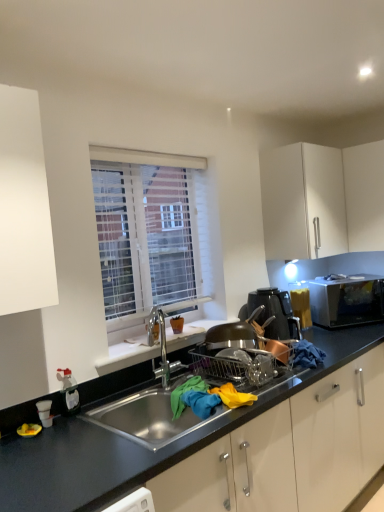
Image resolution: width=384 pixels, height=512 pixels. I want to click on white matte window sill at center, so click(x=127, y=355).

Where is `white matte cabinet at upper right`? The image size is (384, 512). white matte cabinet at upper right is located at coordinates (302, 200).

What do you see at coordinates (302, 200) in the screenshot? The width and height of the screenshot is (384, 512). I see `white matte cabinet at upper right` at bounding box center [302, 200].

Where is `metallic copper pot at right`? The height and width of the screenshot is (512, 384). metallic copper pot at right is located at coordinates (275, 313).

Locate an element on the screen. The image size is (384, 512). stainless steel sink at center is located at coordinates (148, 417).

Where is `white matte window sill at center`? The height and width of the screenshot is (512, 384). white matte window sill at center is located at coordinates (127, 355).

From the image's perspective, is white matte window sill at center positioned above or below white textured blinds at upper center?

white matte window sill at center is below white textured blinds at upper center.

Between point (138, 349) and point (149, 241), which one is positioned behind?

The point (149, 241) is more distant.

Locate an element on the screen. Image resolution: width=384 pixels, height=512 pixels. window sill on the right of white textured blinds at upper center is located at coordinates (127, 355).

Looking at their sizes, would you say white matte window sill at center is wider or thinner than white textured blinds at upper center?

white matte window sill at center is wider than white textured blinds at upper center.

Considering the points (114, 346) and (321, 244), which point is in front, point (114, 346) or point (321, 244)?

The point (114, 346) is closer.

Considering their positions, is white matte window sill at center located in front of or behind white matte cabinet at upper right?

white matte window sill at center is positioned closer to the viewer than white matte cabinet at upper right.

How many degrees apart are the facing directions of white matte window sill at center and white matte cabinet at upper right?

white matte window sill at center and white matte cabinet at upper right are facing 0.478 degrees away from each other.

Can you confirm if white matte window sill at center is positioned to the left of white matte cabinet at upper right?

Correct, you'll find white matte window sill at center to the left of white matte cabinet at upper right.

Can you confirm if satin silver microwave at right is positioned to the right of white matte window sill at center?

Indeed, satin silver microwave at right is positioned on the right side of white matte window sill at center.

The width and height of the screenshot is (384, 512). I want to click on microwave oven that is above the white matte window sill at center (from a real-world perspective), so click(346, 300).

Is satin silver microwave at right situated inside white matte window sill at center or outside?

The correct answer is: outside.

Which is in front, point (375, 295) or point (179, 339)?

The point (179, 339) is more forward.

Considering the sizes of stainless steel sink at center and white matte cabinet at upper right in the image, is stainless steel sink at center wider or thinner than white matte cabinet at upper right?

Clearly, stainless steel sink at center has more width compared to white matte cabinet at upper right.

Which object is positioned more to the right, stainless steel sink at center or white matte cabinet at upper right?

Positioned to the right is white matte cabinet at upper right.

Which is farther from the camera, (144, 426) or (331, 170)?

The point (331, 170) is behind.

What's the angular difference between stainless steel sink at center and white matte cabinet at upper right's facing directions?

The angular difference between stainless steel sink at center and white matte cabinet at upper right is 0.454 degrees.

Which of these two, metallic copper pot at right or satin silver microwave at right, stands taller?

Standing taller between the two is metallic copper pot at right.

The width and height of the screenshot is (384, 512). Find the location of `home appliance above the satin silver microwave at right (from a real-world perspective)`. home appliance above the satin silver microwave at right (from a real-world perspective) is located at coordinates (275, 313).

Would you consider metallic copper pot at right to be distant from satin silver microwave at right?

No.

Considering the relative sizes of satin silver microwave at right and stainless steel sink at center in the image provided, is satin silver microwave at right shorter than stainless steel sink at center?

Correct, satin silver microwave at right is not as tall as stainless steel sink at center.

Locate an element on the screen. This screenshot has width=384, height=512. sink in front of the satin silver microwave at right is located at coordinates (148, 417).

In the scene shown: Considering the sizes of objects satin silver microwave at right and stainless steel sink at center in the image provided, who is smaller, satin silver microwave at right or stainless steel sink at center?

With smaller size is satin silver microwave at right.

Is stainless steel sink at center surrounded by satin silver microwave at right?

No, stainless steel sink at center is located outside of satin silver microwave at right.

Could you tell me if satin silver microwave at right is turned towards metallic copper pot at right?

No, satin silver microwave at right is not aimed at metallic copper pot at right.

Is satin silver microwave at right next to metallic copper pot at right?

No, satin silver microwave at right is not making contact with metallic copper pot at right.

Can we say satin silver microwave at right lies outside metallic copper pot at right?

Yes.

Where is `window sill on the right of white textured blinds at upper center`? This screenshot has height=512, width=384. window sill on the right of white textured blinds at upper center is located at coordinates (127, 355).

Find the location of a particular element. This screenshot has height=512, width=384. window sill below the white matte cabinet at upper right (from the image's perspective) is located at coordinates (127, 355).

When comparing their distances from satin silver microwave at right, does white textured blinds at upper center or metallic copper pot at right seem closer?

The object closer to satin silver microwave at right is metallic copper pot at right.

Considering their positions, is metallic copper pot at right positioned further to satin silver microwave at right than white matte window sill at center?

Among the two, white matte window sill at center is located further to satin silver microwave at right.

Consider the image. From the image, which object appears to be farther from white matte cabinet at upper right, satin silver microwave at right or white matte window sill at center?

white matte window sill at center is further to white matte cabinet at upper right.

Looking at the image, which one is located closer to satin silver microwave at right, white textured blinds at upper center or white matte cabinet at upper right?

white matte cabinet at upper right is closer to satin silver microwave at right.

Which object lies nearer to the anchor point white matte cabinet at upper right, stainless steel sink at center or white textured blinds at upper center?

white textured blinds at upper center is closer to white matte cabinet at upper right.

Considering their positions, is white matte cabinet at upper right positioned further to white textured blinds at upper center than stainless steel sink at center?

white matte cabinet at upper right is positioned further to the anchor white textured blinds at upper center.

From the picture: From the image, which object appears to be nearer to white matte window sill at center, satin silver microwave at right or metallic copper pot at right?

metallic copper pot at right is positioned closer to the anchor white matte window sill at center.

Based on their spatial positions, is white matte window sill at center or satin silver microwave at right further from stainless steel sink at center?

Among the two, satin silver microwave at right is located further to stainless steel sink at center.

Locate an element on the screen. This screenshot has width=384, height=512. home appliance between stainless steel sink at center and white matte cabinet at upper right in the front-back direction is located at coordinates (275, 313).

Identify the location of microwave oven between white matte cabinet at upper right and metallic copper pot at right in the up-down direction. click(x=346, y=300).

Image resolution: width=384 pixels, height=512 pixels. Find the location of `home appliance between white textured blinds at upper center and white matte cabinet at upper right`. home appliance between white textured blinds at upper center and white matte cabinet at upper right is located at coordinates (275, 313).

Locate an element on the screen. This screenshot has height=512, width=384. window between stainless steel sink at center and metallic copper pot at right from front to back is located at coordinates (146, 233).